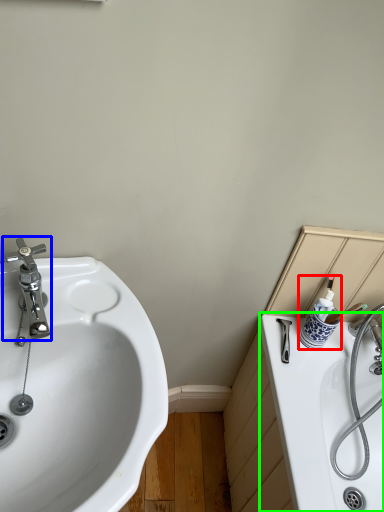
Question: Which object is positioned farthest from toiletry (highlighted by a red box)? Select from tap (highlighted by a blue box) and bath (highlighted by a green box).

Choices:
 (A) tap
 (B) bath

Answer: (A)